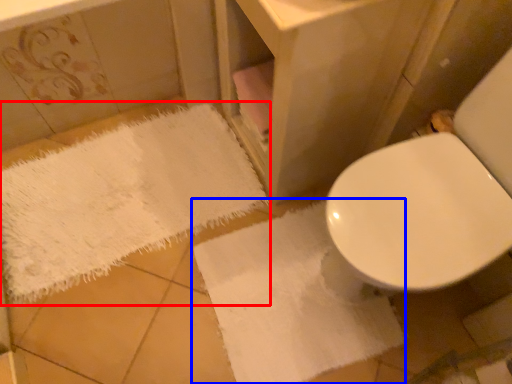
Question: Which object appears farthest to the camera in this image, bath towel (highlighted by a red box) or bath towel (highlighted by a blue box)?

Choices:
 (A) bath towel
 (B) bath towel

Answer: (A)